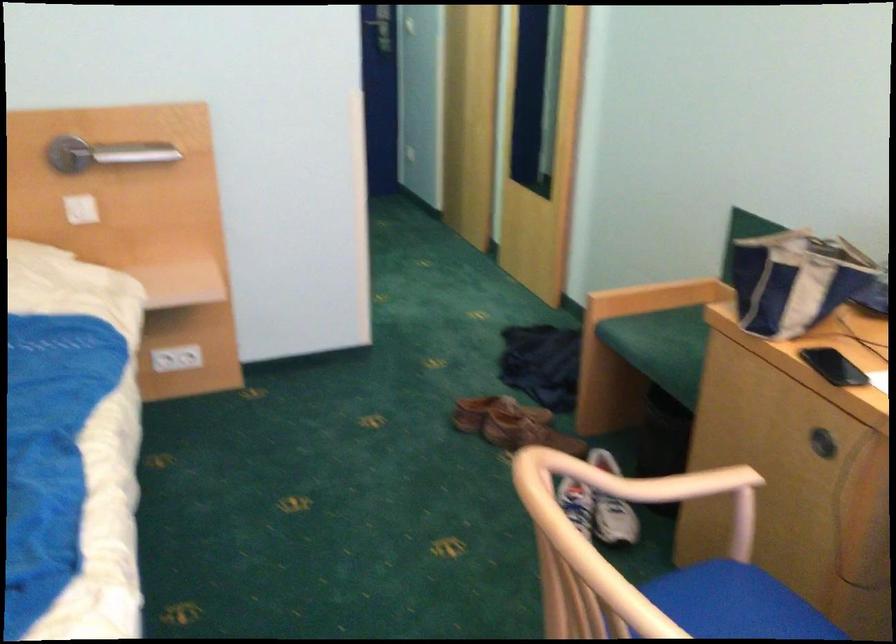
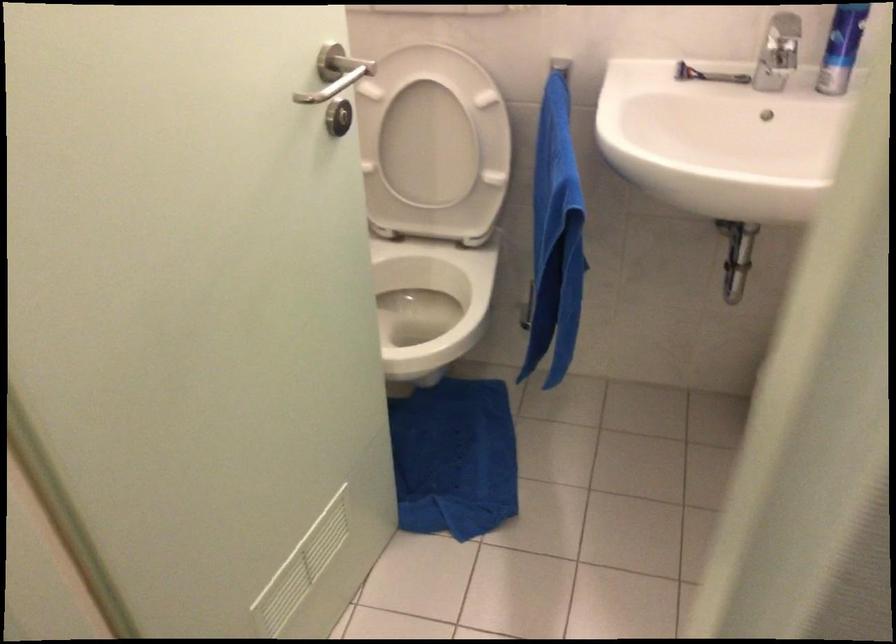
Question: I am providing you with two images of the same scene from different viewpoints. Which of the following objects are not visible in image2?

Choices:
 (A) faucet handle
 (B) picture magnet
 (C) blue towel
 (D) white power socket

Answer: (D)